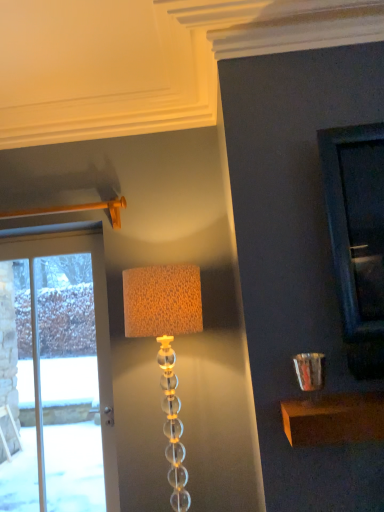
Image resolution: width=384 pixels, height=512 pixels. Describe the element at coordinates (166, 345) in the screenshot. I see `translucent glass lamp at center` at that location.

Locate an element on the screen. The image size is (384, 512). translucent glass lamp at center is located at coordinates (166, 345).

The width and height of the screenshot is (384, 512). What do you see at coordinates (95, 324) in the screenshot?
I see `white glass door at left` at bounding box center [95, 324].

In order to face white glass door at left, should I rotate leftwards or rightwards?

To face it directly, rotate left by 17.892 degrees.

The width and height of the screenshot is (384, 512). In order to click on white glass door at left in this screenshot , I will do (95, 324).

Locate an element on the screen. translucent glass lamp at center is located at coordinates (166, 345).

Is white glass door at left to the left or to the right of translucent glass lamp at center in the image?

In the image, white glass door at left appears on the left side of translucent glass lamp at center.

Relative to translucent glass lamp at center, is white glass door at left in front or behind?

white glass door at left is behind translucent glass lamp at center.

Is point (106, 354) positioned in front of point (172, 486)?

No, it is not.

From the image's perspective, who appears lower, white glass door at left or translucent glass lamp at center?

white glass door at left.

From a real-world perspective, is white glass door at left located higher than translucent glass lamp at center?

Correct, in the physical world, white glass door at left is higher than translucent glass lamp at center.

Can you confirm if white glass door at left is wider than translucent glass lamp at center?

In fact, white glass door at left might be narrower than translucent glass lamp at center.

Who is shorter, white glass door at left or translucent glass lamp at center?

With less height is translucent glass lamp at center.

Based on their sizes in the image, would you say white glass door at left is bigger or smaller than translucent glass lamp at center?

A: In the image, white glass door at left appears to be smaller than translucent glass lamp at center.

Is white glass door at left spatially inside translucent glass lamp at center, or outside of it?

white glass door at left cannot be found inside translucent glass lamp at center.

Would you consider white glass door at left to be distant from translucent glass lamp at center?

white glass door at left is near translucent glass lamp at center, not far away.

Is white glass door at left turned away from translucent glass lamp at center?

No, white glass door at left is not facing away from translucent glass lamp at center.

You are a GUI agent. You are given a task and a screenshot of the screen. Output one action in this format:
    pyautogui.click(x=<x>, y=<y>)
    Task: Click on the lamp on the right of white glass door at left
    
    Given the screenshot: What is the action you would take?
    pyautogui.click(x=166, y=345)

Between translucent glass lamp at center and white glass door at left, which one appears on the left side from the viewer's perspective?

From the viewer's perspective, white glass door at left appears more on the left side.

Which object is further away from the camera taking this photo, translucent glass lamp at center or white glass door at left?

Positioned behind is white glass door at left.

Does point (180, 270) lie in front of point (102, 434)?

Yes.

From the image's perspective, relative to white glass door at left, is translucent glass lamp at center above or below?

Based on their image positions, translucent glass lamp at center is located above white glass door at left.

From a real-world perspective, which object rests below the other?

From a 3D spatial view, translucent glass lamp at center is below.

Can you confirm if translucent glass lamp at center is wider than white glass door at left?

Indeed, translucent glass lamp at center has a greater width compared to white glass door at left.

In the scene shown: Who is taller, translucent glass lamp at center or white glass door at left?

Standing taller between the two is white glass door at left.

Which of these two, translucent glass lamp at center or white glass door at left, is smaller?

white glass door at left is smaller.

Is translucent glass lamp at center completely or partially outside of white glass door at left?

Indeed, translucent glass lamp at center is completely outside white glass door at left.

Does translucent glass lamp at center touch white glass door at left?

No, translucent glass lamp at center is not making contact with white glass door at left.

Could you tell me if translucent glass lamp at center is facing white glass door at left?

No, translucent glass lamp at center is not facing towards white glass door at left.

How far apart are translucent glass lamp at center and white glass door at left?

They are 30.01 inches apart.

Find the location of a particular element. lamp on the right of white glass door at left is located at coordinates point(166,345).

Where is `door located below the translucent glass lamp at center (from the image's perspective)`? This screenshot has width=384, height=512. door located below the translucent glass lamp at center (from the image's perspective) is located at coordinates (95, 324).

Locate an element on the screen. The height and width of the screenshot is (512, 384). door behind the translucent glass lamp at center is located at coordinates (95, 324).